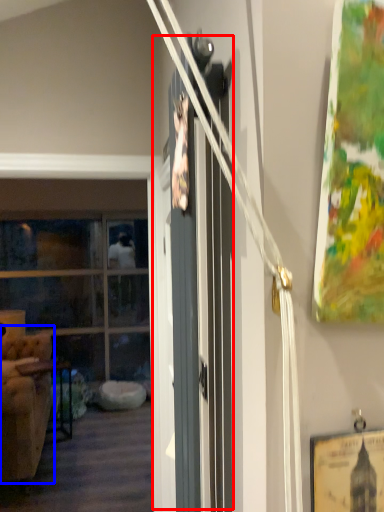
Question: Which point is closer to the camera, barn door (highlighted by a red box) or armchair (highlighted by a blue box)?

Choices:
 (A) barn door
 (B) armchair

Answer: (A)